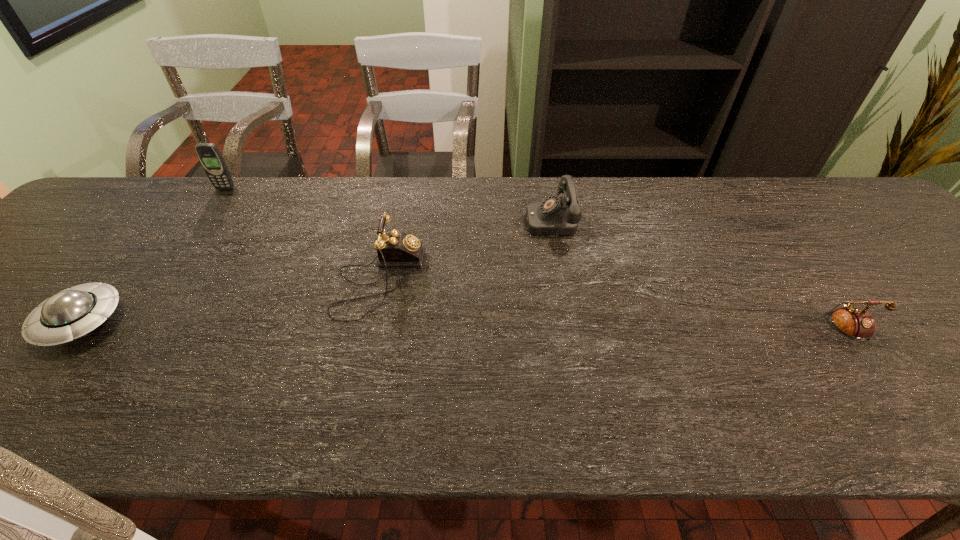
The width and height of the screenshot is (960, 540). I want to click on vacant region at the left edge of the desktop, so click(x=6, y=346).

The width and height of the screenshot is (960, 540). In order to click on empty space that is in between the leftmost telephone and the farthest object in this screenshot , I will do `click(302, 234)`.

Where is `vacant area that lies between the second telephone from left to right and the shortest telephone`? Image resolution: width=960 pixels, height=540 pixels. vacant area that lies between the second telephone from left to right and the shortest telephone is located at coordinates (691, 275).

You are a GUI agent. You are given a task and a screenshot of the screen. Output one action in this format:
    pyautogui.click(x=<x>, y=<y>)
    Task: Click on the free space between the saucer and the cellular telephone
    The height and width of the screenshot is (540, 960).
    Given the screenshot: What is the action you would take?
    pyautogui.click(x=153, y=255)

I want to click on unoccupied position between the cellular telephone and the third object from right to left, so click(x=302, y=234).

You are a GUI agent. You are given a task and a screenshot of the screen. Output one action in this format:
    pyautogui.click(x=<x>, y=<y>)
    Task: Click on the vacant area that lies between the third object from left to right and the rightmost telephone
    This screenshot has height=540, width=960.
    Given the screenshot: What is the action you would take?
    pyautogui.click(x=606, y=306)

The width and height of the screenshot is (960, 540). I want to click on vacant area that lies between the rightmost telephone and the second telephone from left to right, so click(x=691, y=275).

Image resolution: width=960 pixels, height=540 pixels. In order to click on vacant area between the third object from left to right and the saucer in this screenshot , I will do `click(229, 300)`.

Identify the location of unoccupied area between the tallest object and the third object from right to left. (302, 234).

Where is `vacant space that's between the leftmost telephone and the saucer`? The width and height of the screenshot is (960, 540). vacant space that's between the leftmost telephone and the saucer is located at coordinates (229, 300).